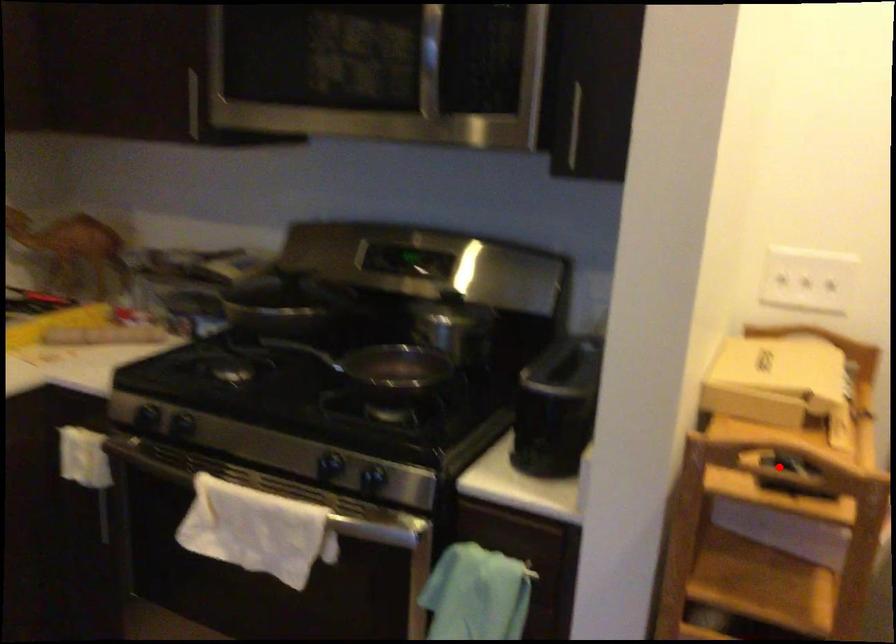
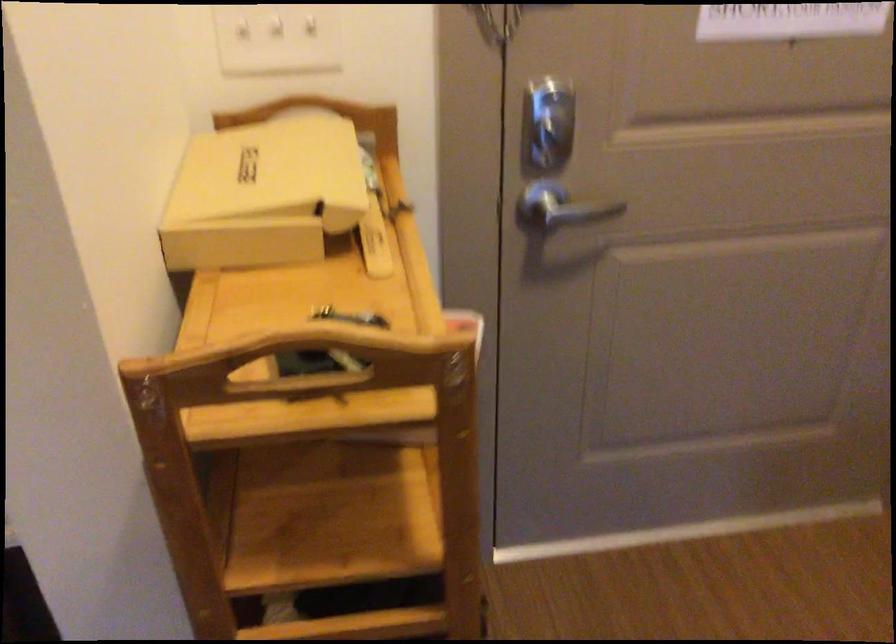
In the second image, find the point that corresponds to the highlighted location in the first image.

(300, 364)